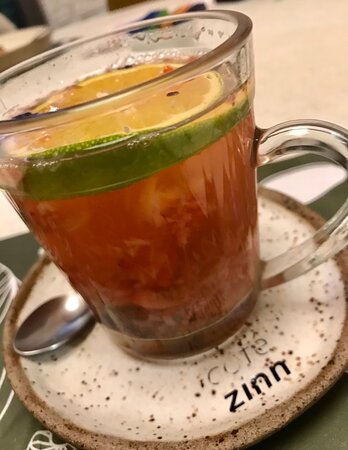
The width and height of the screenshot is (348, 450). I want to click on spoon, so click(x=51, y=328).